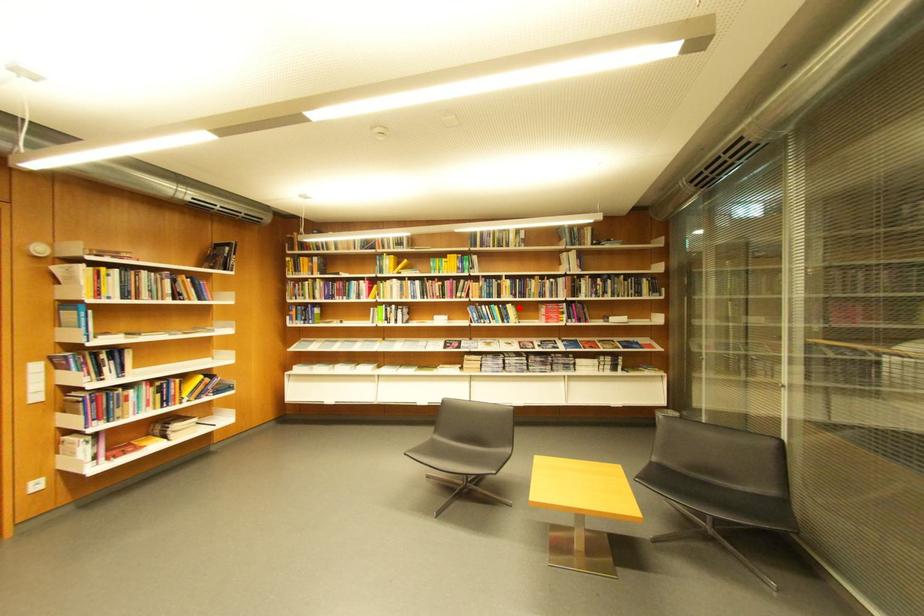
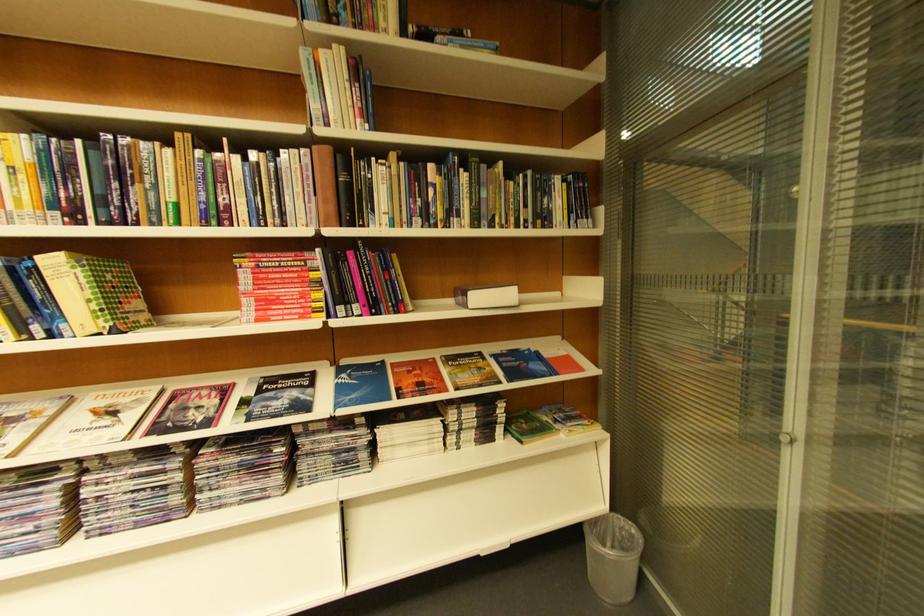
Question: I am providing you with two images of the same scene from different viewpoints. A red point is marked on the first image. Can you still see the location of the red point in image 2?

Choices:
 (A) Yes
 (B) No

Answer: (A)